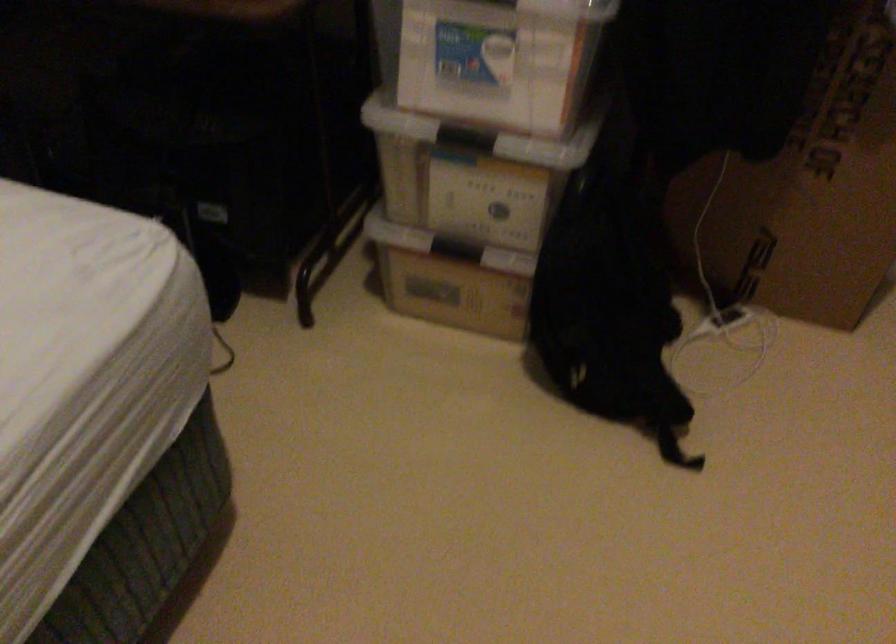
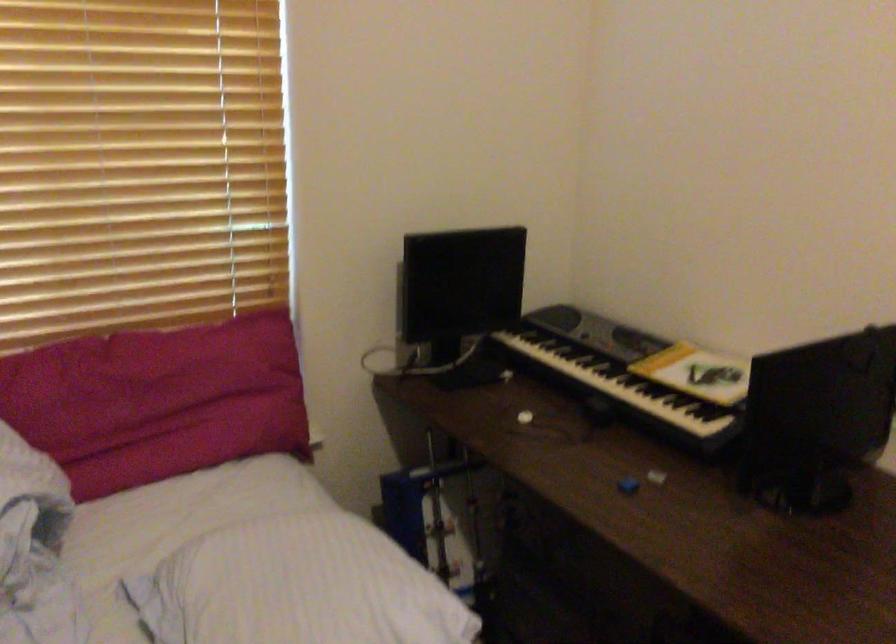
How did the camera likely rotate?

The camera rotated toward left-up.